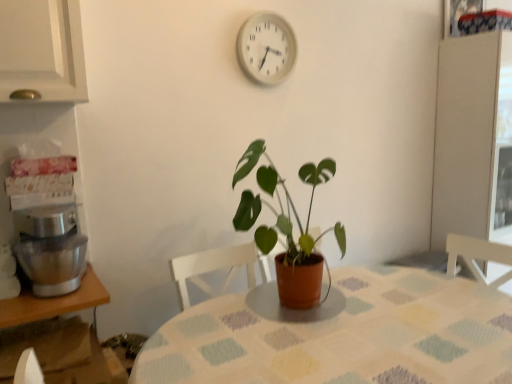
At what (x,y) coordinates should I click in order to perform the action: click on silver metallic mixer at left. Please return your answer as a coordinate pair (x, y). This screenshot has height=384, width=512. Looking at the image, I should click on (51, 248).

This screenshot has width=512, height=384. Describe the element at coordinates (266, 48) in the screenshot. I see `white plastic clock at upper center` at that location.

Where is `textured fabric table at center, placed as the second table when sorted from left to right`? The width and height of the screenshot is (512, 384). textured fabric table at center, placed as the second table when sorted from left to right is located at coordinates (340, 335).

What do you see at coordinates (53, 302) in the screenshot? I see `wooden table at lower left, placed as the 2th table when sorted from right to left` at bounding box center [53, 302].

You are a GUI agent. You are given a task and a screenshot of the screen. Output one action in this format:
    pyautogui.click(x=<x>, y=<y>)
    Task: Click on the silver metallic mixer at left
    
    Given the screenshot: What is the action you would take?
    pyautogui.click(x=51, y=248)

Does white plastic clock at upper center have a larger size compared to wooden table at lower left, placed as the 2th table when sorted from right to left?

No.

Is white plastic clock at upper center in front of or behind wooden table at lower left, which appears as the 1th table when viewed from the left, in the image?

Clearly, white plastic clock at upper center is behind wooden table at lower left, which appears as the 1th table when viewed from the left.

Between white plastic clock at upper center and wooden table at lower left, which appears as the 1th table when viewed from the left, which one has smaller width?

white plastic clock at upper center.

Is white plastic clock at upper center facing away from wooden table at lower left, which appears as the 1th table when viewed from the left?

No, white plastic clock at upper center's orientation is not away from wooden table at lower left, which appears as the 1th table when viewed from the left.

At what (x,y) coordinates should I click in order to perform the action: click on houseplant behind the wooden table at lower left, placed as the 2th table when sorted from right to left. Please return your answer as a coordinate pair (x, y). The image size is (512, 384). Looking at the image, I should click on (288, 227).

From the image's perspective, is green matte plant at center located above or below wooden table at lower left, which appears as the 1th table when viewed from the left?

green matte plant at center is situated higher than wooden table at lower left, which appears as the 1th table when viewed from the left, in the image.

Is green matte plant at center taller or shorter than wooden table at lower left, placed as the 2th table when sorted from right to left?

Considering their sizes, green matte plant at center has more height than wooden table at lower left, placed as the 2th table when sorted from right to left.

From the image's perspective, relative to silver metallic mixer at left, is wooden table at lower left, placed as the 2th table when sorted from right to left, above or below?

Based on their image positions, wooden table at lower left, placed as the 2th table when sorted from right to left, is located beneath silver metallic mixer at left.

Is wooden table at lower left, placed as the 2th table when sorted from right to left, not close to silver metallic mixer at left?

That's not correct — wooden table at lower left, placed as the 2th table when sorted from right to left, is a little close to silver metallic mixer at left.

From a real-world perspective, does wooden table at lower left, placed as the 2th table when sorted from right to left, sit lower than silver metallic mixer at left?

Indeed, from a real-world perspective, wooden table at lower left, placed as the 2th table when sorted from right to left, is positioned beneath silver metallic mixer at left.

Is wooden table at lower left, which appears as the 1th table when viewed from the left, aimed at silver metallic mixer at left?

No.

How far apart are textured fabric table at center, which appears as the first table when viewed from the right, and green matte plant at center?

textured fabric table at center, which appears as the first table when viewed from the right, and green matte plant at center are 12.51 inches apart from each other.

Considering the sizes of textured fabric table at center, placed as the second table when sorted from left to right, and green matte plant at center in the image, is textured fabric table at center, placed as the second table when sorted from left to right, taller or shorter than green matte plant at center?

Considering their sizes, textured fabric table at center, placed as the second table when sorted from left to right, has more height than green matte plant at center.

Can you tell me how much textured fabric table at center, which appears as the first table when viewed from the right, and green matte plant at center differ in facing direction?

2.29 degrees separate the facing orientations of textured fabric table at center, which appears as the first table when viewed from the right, and green matte plant at center.

From the image's perspective, which is above, textured fabric table at center, which appears as the first table when viewed from the right, or green matte plant at center?

green matte plant at center appears higher in the image.

In terms of height, does wooden table at lower left, which appears as the 1th table when viewed from the left, look taller or shorter compared to textured fabric table at center, which appears as the first table when viewed from the right?

In the image, wooden table at lower left, which appears as the 1th table when viewed from the left, appears to be shorter than textured fabric table at center, which appears as the first table when viewed from the right.

Find the location of a particular element. table below the wooden table at lower left, which appears as the 1th table when viewed from the left (from a real-world perspective) is located at coordinates (340, 335).

From a real-world perspective, is wooden table at lower left, placed as the 2th table when sorted from right to left, positioned under textured fabric table at center, placed as the second table when sorted from left to right, based on gravity?

No, from a real-world perspective, wooden table at lower left, placed as the 2th table when sorted from right to left, is not below textured fabric table at center, placed as the second table when sorted from left to right.

Considering the positions of objects wooden table at lower left, which appears as the 1th table when viewed from the left, and textured fabric table at center, which appears as the first table when viewed from the right, in the image provided, who is more to the right, wooden table at lower left, which appears as the 1th table when viewed from the left, or textured fabric table at center, which appears as the first table when viewed from the right,?

textured fabric table at center, which appears as the first table when viewed from the right, is more to the right.

From a real-world perspective, is wooden table at lower left, which appears as the 1th table when viewed from the left, below green matte plant at center?

Yes, from a real-world perspective, wooden table at lower left, which appears as the 1th table when viewed from the left, is below green matte plant at center.

Looking at this image, considering the positions of objects wooden table at lower left, placed as the 2th table when sorted from right to left, and green matte plant at center in the image provided, who is more to the right, wooden table at lower left, placed as the 2th table when sorted from right to left, or green matte plant at center?

green matte plant at center.

Is the position of wooden table at lower left, placed as the 2th table when sorted from right to left, more distant than that of green matte plant at center?

No, it is in front of green matte plant at center.

Considering the points (56, 314) and (283, 254), which point is behind, point (56, 314) or point (283, 254)?

The point (283, 254) is more distant.

Considering the sizes of textured fabric table at center, placed as the second table when sorted from left to right, and white plastic clock at upper center in the image, is textured fabric table at center, placed as the second table when sorted from left to right, taller or shorter than white plastic clock at upper center?

Clearly, textured fabric table at center, placed as the second table when sorted from left to right, is taller compared to white plastic clock at upper center.

From a real-world perspective, is textured fabric table at center, placed as the second table when sorted from left to right, physically below white plastic clock at upper center?

Yes, from a real-world perspective, textured fabric table at center, placed as the second table when sorted from left to right, is below white plastic clock at upper center.

Would you say textured fabric table at center, placed as the second table when sorted from left to right, is to the left or to the right of white plastic clock at upper center in the picture?

textured fabric table at center, placed as the second table when sorted from left to right, is to the right of white plastic clock at upper center.

In terms of width, does textured fabric table at center, which appears as the first table when viewed from the right, look wider or thinner when compared to white plastic clock at upper center?

textured fabric table at center, which appears as the first table when viewed from the right, is wider than white plastic clock at upper center.

This screenshot has height=384, width=512. I want to click on clock that appears above the wooden table at lower left, placed as the 2th table when sorted from right to left (from a real-world perspective), so pos(266,48).

Identify the location of houseplant located above the wooden table at lower left, which appears as the 1th table when viewed from the left (from the image's perspective). [288, 227].

Consider the image. Which object lies nearer to the anchor point silver metallic mixer at left, green matte plant at center or wooden table at lower left, placed as the 2th table when sorted from right to left?

Based on the image, wooden table at lower left, placed as the 2th table when sorted from right to left, appears to be nearer to silver metallic mixer at left.

When comparing their distances from green matte plant at center, does textured fabric table at center, which appears as the first table when viewed from the right, or silver metallic mixer at left seem closer?

textured fabric table at center, which appears as the first table when viewed from the right, is positioned closer to the anchor green matte plant at center.

Based on the photo, based on their spatial positions, is wooden table at lower left, placed as the 2th table when sorted from right to left, or silver metallic mixer at left closer to white plastic clock at upper center?

Based on the image, silver metallic mixer at left appears to be nearer to white plastic clock at upper center.

Looking at this image, which object lies further to the anchor point wooden table at lower left, placed as the 2th table when sorted from right to left, silver metallic mixer at left or textured fabric table at center, placed as the second table when sorted from left to right?

The object further to wooden table at lower left, placed as the 2th table when sorted from right to left, is textured fabric table at center, placed as the second table when sorted from left to right.

Which object lies nearer to the anchor point wooden table at lower left, which appears as the 1th table when viewed from the left, textured fabric table at center, which appears as the first table when viewed from the right, or silver metallic mixer at left?

silver metallic mixer at left is closer to wooden table at lower left, which appears as the 1th table when viewed from the left.

Which object lies nearer to the anchor point green matte plant at center, wooden table at lower left, placed as the 2th table when sorted from right to left, or textured fabric table at center, placed as the second table when sorted from left to right?

textured fabric table at center, placed as the second table when sorted from left to right, lies closer to green matte plant at center than the other object.

Based on their spatial positions, is wooden table at lower left, which appears as the 1th table when viewed from the left, or textured fabric table at center, which appears as the first table when viewed from the right, further from white plastic clock at upper center?

wooden table at lower left, which appears as the 1th table when viewed from the left, lies further to white plastic clock at upper center than the other object.

When comparing their distances from wooden table at lower left, placed as the 2th table when sorted from right to left, does white plastic clock at upper center or silver metallic mixer at left seem further?

white plastic clock at upper center is positioned further to the anchor wooden table at lower left, placed as the 2th table when sorted from right to left.

Identify the location of houseplant between wooden table at lower left, which appears as the 1th table when viewed from the left, and textured fabric table at center, placed as the second table when sorted from left to right. (288, 227).

Identify the location of table between silver metallic mixer at left and textured fabric table at center, placed as the second table when sorted from left to right, from left to right. This screenshot has height=384, width=512. (53, 302).

The width and height of the screenshot is (512, 384). What are the coordinates of `mixer between white plastic clock at upper center and textured fabric table at center, which appears as the first table when viewed from the right, vertically` in the screenshot? It's located at (51, 248).

Image resolution: width=512 pixels, height=384 pixels. In order to click on table situated between silver metallic mixer at left and green matte plant at center from left to right in this screenshot , I will do `click(53, 302)`.